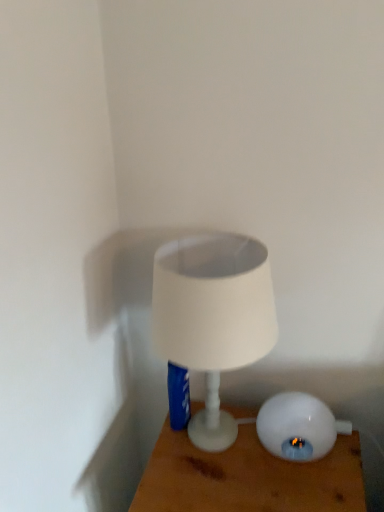
What are the coordinates of `vacant space to the left of white glossy lamp at lower right, the first lamp in the right-to-left sequence` in the screenshot? It's located at (220, 459).